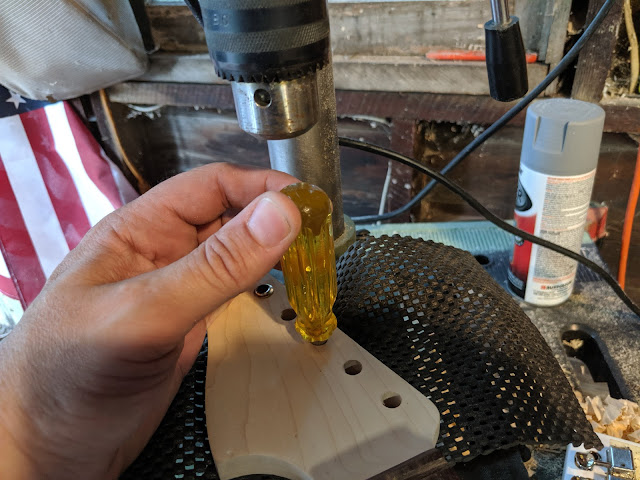
Image resolution: width=640 pixels, height=480 pixels. I want to click on black handle, so click(x=504, y=54).